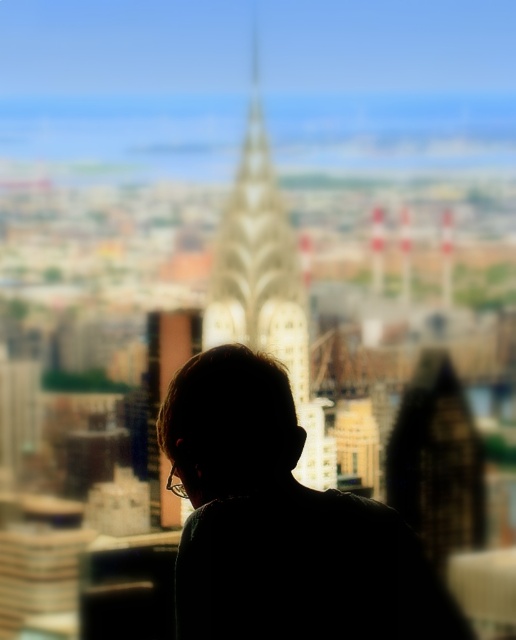
Is silhouette hair at center wider than transparent glass window at center?

Yes, silhouette hair at center is wider than transparent glass window at center.

Can you confirm if silhouette hair at center is positioned above transparent glass window at center?

Incorrect, silhouette hair at center is not positioned above transparent glass window at center.

Does point (279, 483) come in front of point (356, 465)?

That is True.

Image resolution: width=516 pixels, height=640 pixels. Identify the location of silhouette hair at center. (281, 524).

Is white marble tower at center wider than transparent glass window at center?

Yes, white marble tower at center is wider than transparent glass window at center.

Is white marble tower at center to the left of transparent glass window at center from the viewer's perspective?

Yes, white marble tower at center is to the left of transparent glass window at center.

Which is in front, point (312, 468) or point (352, 451)?

Point (312, 468)

Locate an element on the screen. Image resolution: width=516 pixels, height=640 pixels. white marble tower at center is located at coordinates (266, 288).

Which is behind, point (372, 515) or point (249, 172)?

The point (372, 515) is behind.

Which of these two, silhouette hair at center or white marble tower at center, stands shorter?

silhouette hair at center

Describe the element at coordinates (281, 524) in the screenshot. This screenshot has height=640, width=516. I see `silhouette hair at center` at that location.

This screenshot has width=516, height=640. I want to click on silhouette hair at center, so tap(281, 524).